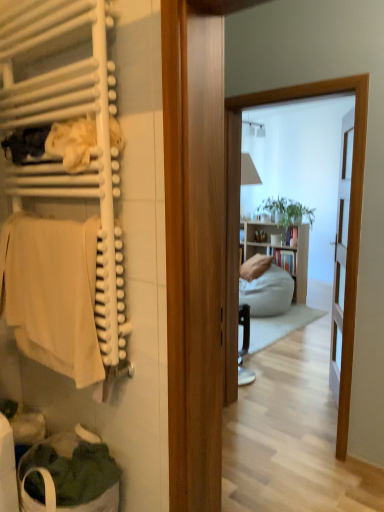
Question: From the image's perspective, is white matte towel rack at left positioned above or below white fabric laundry basket at lower left?

Choices:
 (A) above
 (B) below

Answer: (A)

Question: From their relative heights in the image, would you say white matte towel rack at left is taller or shorter than white fabric laundry basket at lower left?

Choices:
 (A) tall
 (B) short

Answer: (A)

Question: Considering the real-world distances, which object is closest to the white matte towel rack at left?

Choices:
 (A) white fabric laundry basket at lower left
 (B) beige cotton towel at left

Answer: (B)

Question: Which object is positioned closest to the beige cotton towel at left?

Choices:
 (A) white matte towel rack at left
 (B) white fabric laundry basket at lower left

Answer: (A)